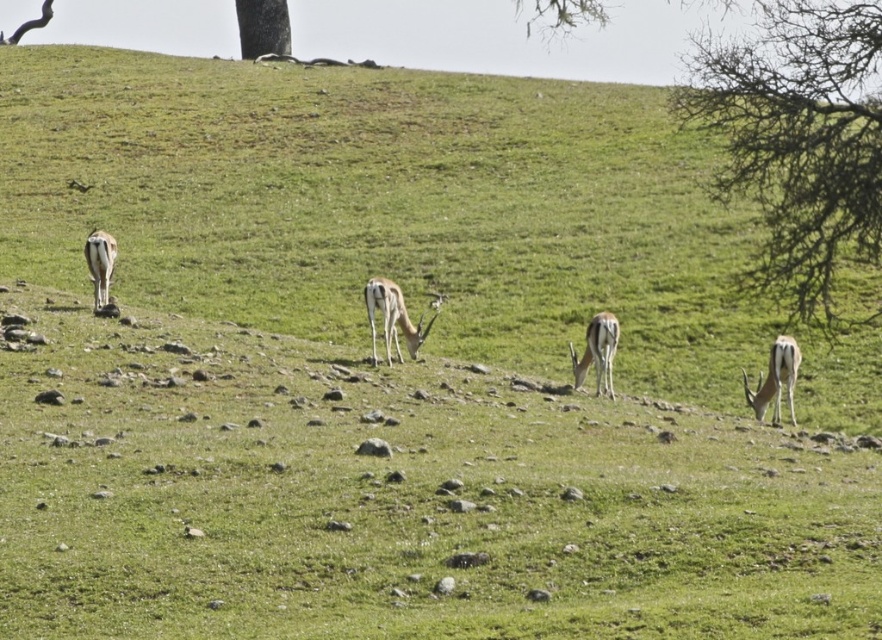
Question: Which point is farther to the camera?

Choices:
 (A) brown glossy antelope at left
 (B) smooth brown antelope at center
 (C) smooth brown antelope at right

Answer: (A)

Question: Considering the real-world distances, which object is closest to the brown glossy antelope at left?

Choices:
 (A) bare branches at upper right
 (B) green leafy tree at upper center

Answer: (A)

Question: Which of the following is the farthest from the observer?

Choices:
 (A) (415, 353)
 (B) (783, 337)
 (C) (103, 269)

Answer: (C)

Question: Is green leafy tree at upper center below brown glossy antelope at left?

Choices:
 (A) yes
 (B) no

Answer: (B)

Question: Does bare branches at upper right have a smaller size compared to brown glossy antelope at left?

Choices:
 (A) no
 (B) yes

Answer: (A)

Question: Is bare branches at upper right bigger than shiny brown antelope at center?

Choices:
 (A) no
 (B) yes

Answer: (B)